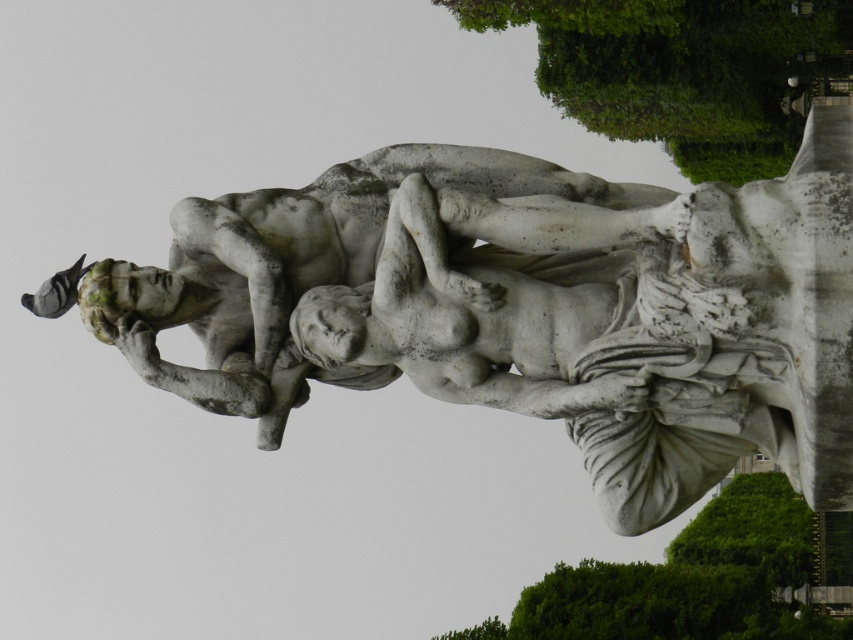
Does green leafy tree at upper right appear under green leafy tree at lower right?

No.

Looking at this image, between green leafy tree at upper right and green leafy tree at lower right, which one is positioned lower?

green leafy tree at lower right is below.

Is point (607, 13) farther from camera compared to point (785, 493)?

No, it is not.

I want to click on green leafy tree at upper right, so click(x=682, y=70).

Which is more to the right, white marble statue at center or green leafy tree at upper right?

green leafy tree at upper right

Is point (157, 307) positioned behind point (483, 13)?

That is False.

The width and height of the screenshot is (853, 640). Identify the location of white marble statue at center. (341, 262).

Consider the image. Is white marble statue at center bigger than green leafy tree at lower right?

Actually, white marble statue at center might be smaller than green leafy tree at lower right.

Which is below, white marble statue at center or green leafy tree at lower right?

green leafy tree at lower right

The image size is (853, 640). Find the location of `white marble statue at center`. white marble statue at center is located at coordinates 341,262.

Where is `white marble statue at center`? This screenshot has height=640, width=853. white marble statue at center is located at coordinates (341, 262).